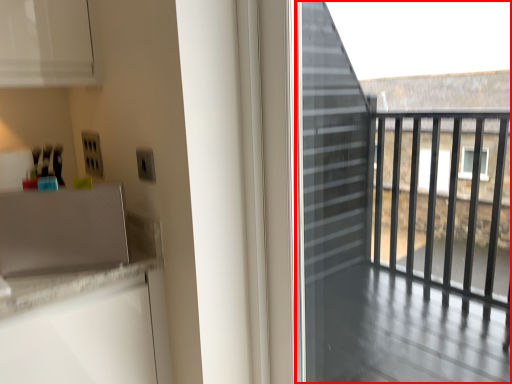
Question: From the image's perspective, what is the correct spatial relationship of screen door (annotated by the red box) in relation to appliance?

Choices:
 (A) below
 (B) above

Answer: (A)